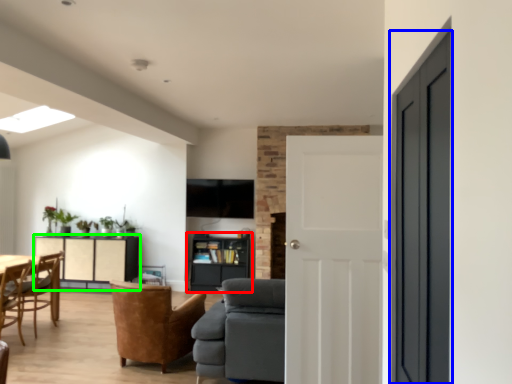
Question: Estimate the real-world distances between objects in this image. Which object is closer to shelf (highlighted by a red box), door (highlighted by a blue box) or cabinetry (highlighted by a green box)?

Choices:
 (A) door
 (B) cabinetry

Answer: (B)